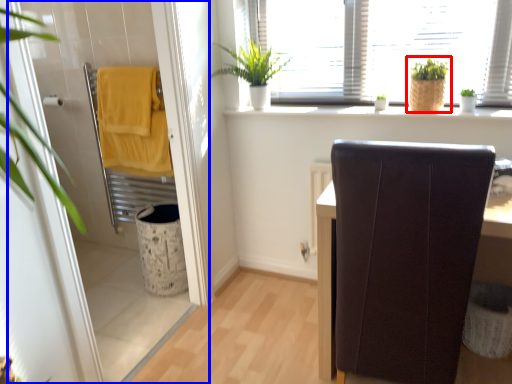
Question: Which object appears closest to the camera in this image, houseplant (highlighted by a red box) or screen door (highlighted by a blue box)?

Choices:
 (A) houseplant
 (B) screen door

Answer: (B)